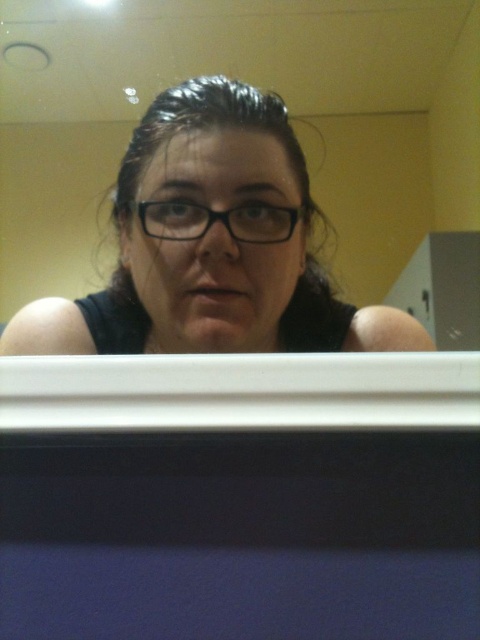
You are a photographer standing in front of the matte black glasses at center. You want to take a closeup photo of the glasses. The camera you are using has a minimum focusing distance of 12 inches. Can you take the photo without moving closer than the minimum focusing distance?

The matte black glasses at center and viewer are 17.11 inches apart from each other. Since the camera can focus as close as 12 inches, you can take the photo without moving closer because the current distance of 17.11 inches is beyond the minimum focusing distance of 12 inches.

You are trying to determine which of the two points, point [122,298] or point [180,232], is closer to you. Based on the scene description, which point is nearer?

Point [122,298] is further to the viewer than point [180,232], so the closer point is point [180,232].

You are an AI assistant analyzing the image. The scene shows a person sitting at a desk with a dark object in the foreground. There is a point labeled at coordinates (213, 244). What object is located at that point?

The point at coordinates (213, 244) corresponds to the matte black glasses at center.